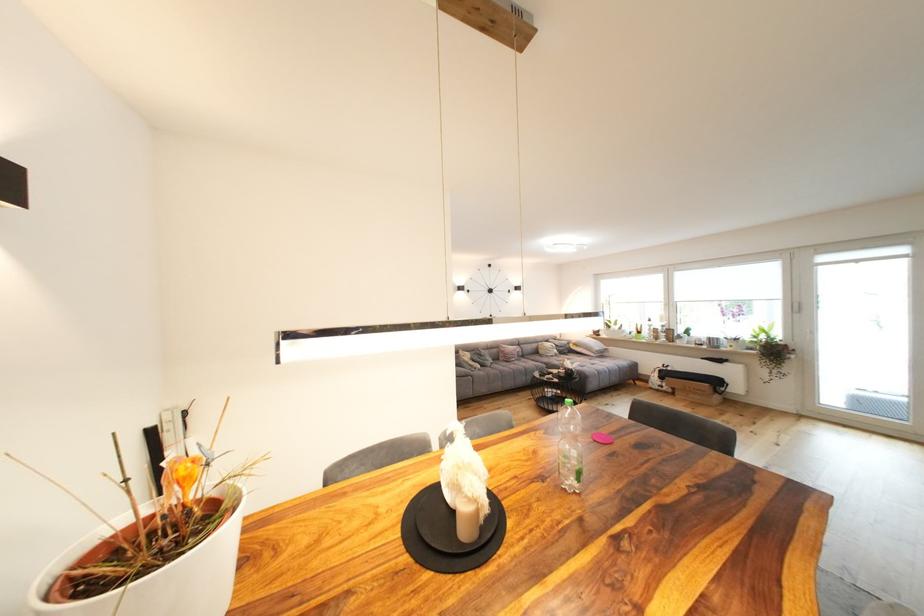
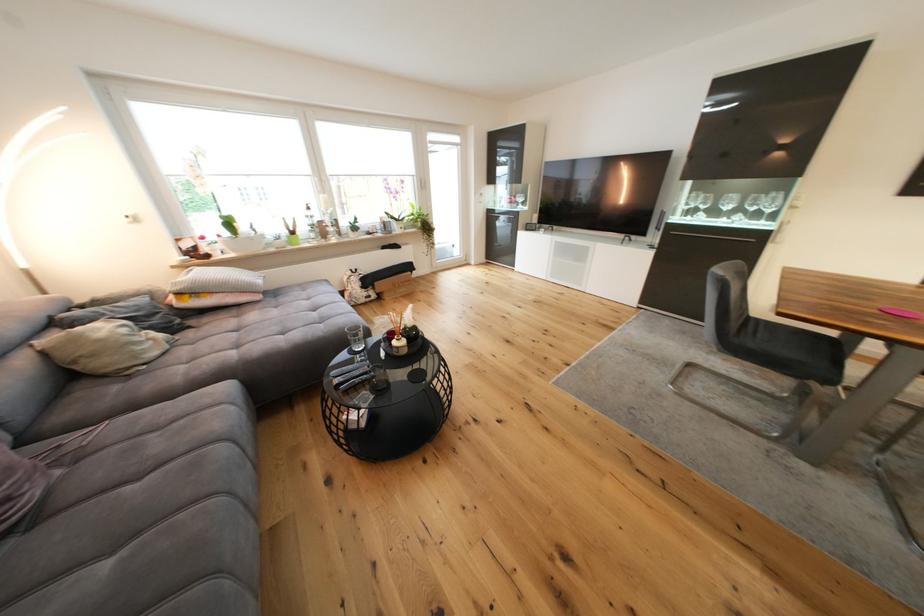
Locate, in the second image, the point that corresponds to (x=564, y=357) in the first image.

(178, 345)